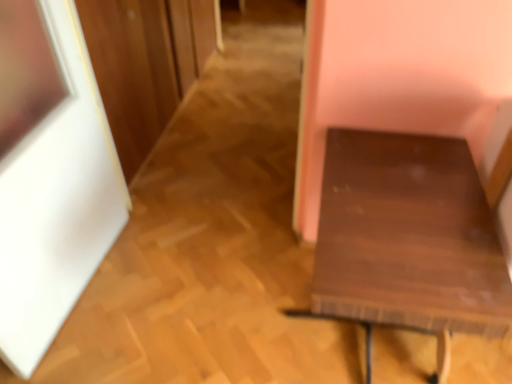
Where is `vacant point above dark wood table at right (from a real-world perspective)`? vacant point above dark wood table at right (from a real-world perspective) is located at coordinates [x=389, y=199].